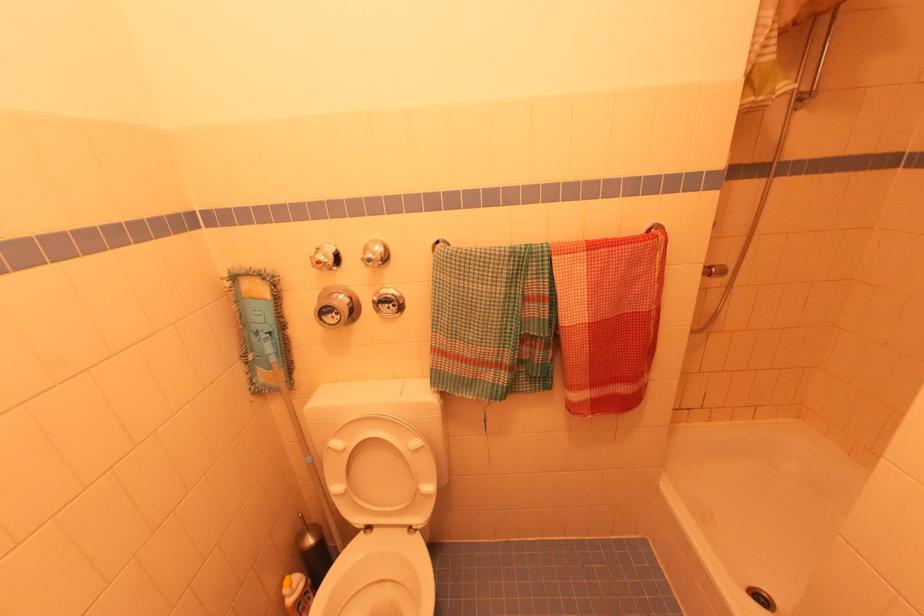
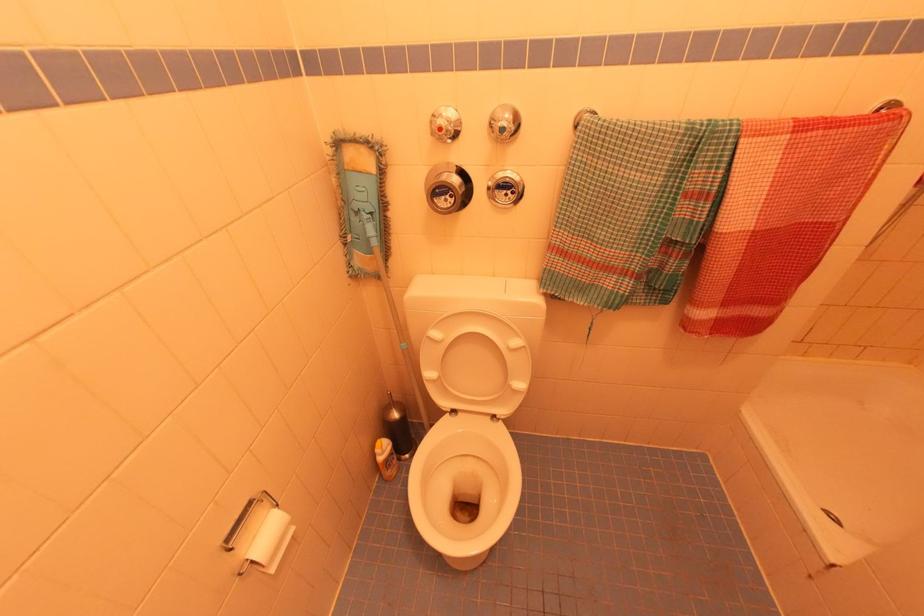
In the second image, find the point that corresponds to point (296, 585) in the first image.

(385, 448)